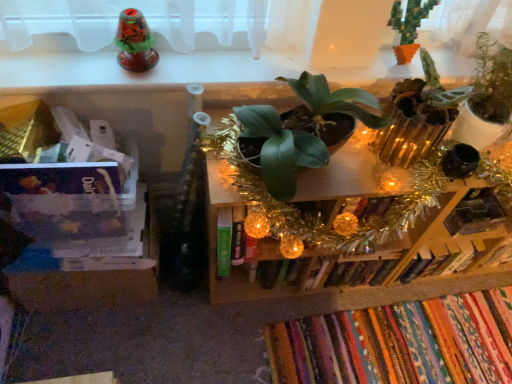
The image size is (512, 384). Identify the location of vacant space underneath multicolored woven rug at lower right, placed as the 2th book when sorted from top to bottom (from a real-world perspective). (403, 337).